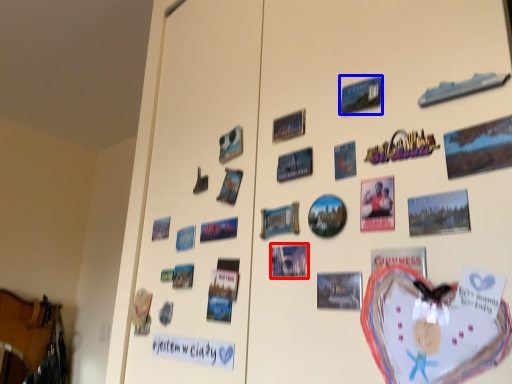
Question: Among these objects, which one is nearest to the camera, postcard (highlighted by a red box) or postcard (highlighted by a blue box)?

Choices:
 (A) postcard
 (B) postcard

Answer: (B)